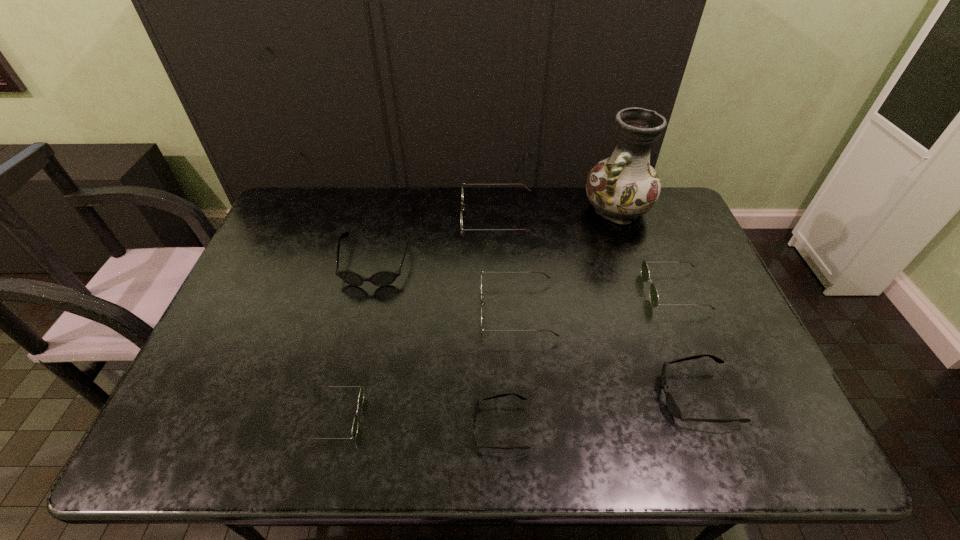
Find the location of a particular element. object that stands as the second closest to the red vase is located at coordinates tap(528, 189).

I want to click on object that is the third closest one to the second black sunglasses from right to left, so click(673, 407).

What are the coordinates of `sunglasses identified as the closest to the smallest black sunglasses` in the screenshot? It's located at (547, 276).

The height and width of the screenshot is (540, 960). Find the location of `sunglasses identified as the closest to the second black sunglasses from right to left`. sunglasses identified as the closest to the second black sunglasses from right to left is located at coordinates (547, 276).

Image resolution: width=960 pixels, height=540 pixels. I want to click on green sunglasses that stands as the closest to the tallest sunglasses, so click(547, 276).

Point out which green sunglasses is positioned as the third nearest to the tallest object. Please provide its 2D coordinates. Your answer should be formatted as a tuple, i.e. [(x, y)], where the tuple contains the x and y coordinates of a point satisfying the conditions above.

[(547, 276)]

Locate an element on the screen. black sunglasses that is the third closest to the nearest green sunglasses is located at coordinates (673, 407).

Where is `black sunglasses that can be found as the closest to the smallest green sunglasses`? The height and width of the screenshot is (540, 960). black sunglasses that can be found as the closest to the smallest green sunglasses is located at coordinates pyautogui.click(x=475, y=409).

Find the location of a particular element. vacant space that satisfies the following two spatial constraints: 1. on the lenses of the biggest black sunglasses; 2. on the front-facing side of the smallest green sunglasses is located at coordinates (339, 417).

In order to click on vacant space that satisfies the following two spatial constraints: 1. on the lenses of the biggest black sunglasses; 2. on the front-facing side of the nearest green sunglasses in this screenshot , I will do `click(339, 417)`.